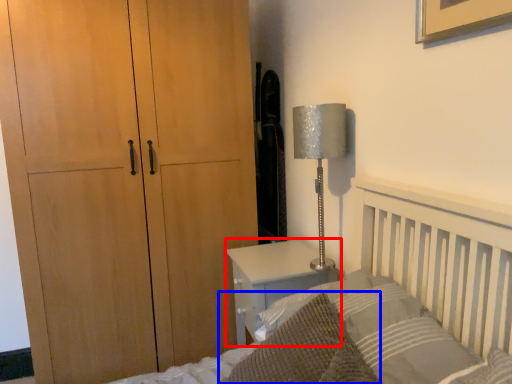
Question: Which point is further to the camera, nightstand (highlighted by a red box) or throw pillow (highlighted by a blue box)?

Choices:
 (A) nightstand
 (B) throw pillow

Answer: (A)